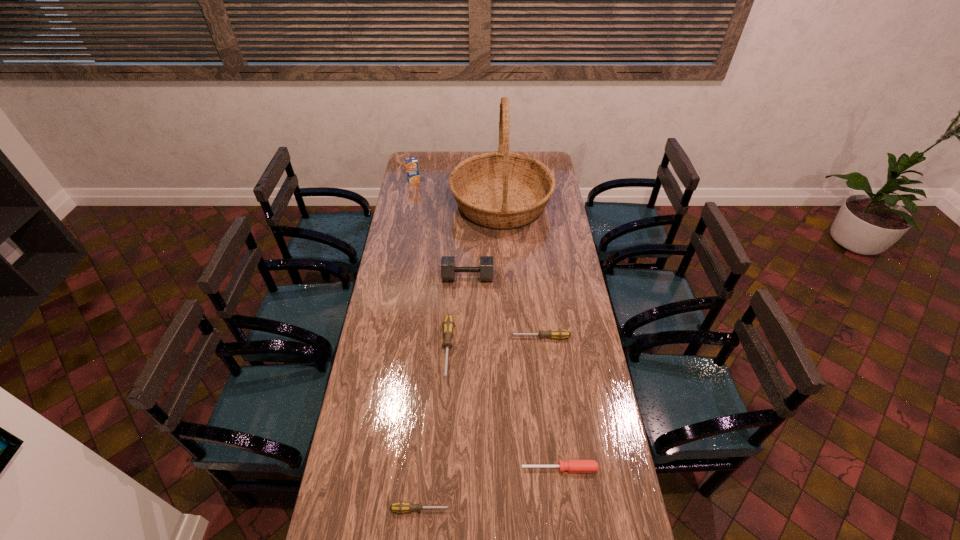
Identify the location of vacant space situated 0.050m on the back of the red screwdriver. This screenshot has height=540, width=960. (557, 448).

Identify the location of free space located 0.370m at the tip of the nearest gray screwdriver. Image resolution: width=960 pixels, height=540 pixels. (575, 509).

This screenshot has height=540, width=960. I want to click on object that is at the left edge, so click(x=412, y=169).

Where is `basket at the right edge`? basket at the right edge is located at coordinates (501, 189).

The height and width of the screenshot is (540, 960). Identify the location of blank space at the far edge of the desktop. (461, 160).

I want to click on vacant space at the left edge of the desktop, so click(x=393, y=322).

You are a GUI agent. You are given a task and a screenshot of the screen. Output one action in this format:
    pyautogui.click(x=<x>, y=<y>)
    Task: Click on the vacant space at the right edge of the desktop
    
    Given the screenshot: What is the action you would take?
    pyautogui.click(x=590, y=349)

The width and height of the screenshot is (960, 540). I want to click on unoccupied position between the red screwdriver and the basket, so click(x=531, y=336).

Where is `vacant area that lies between the basket and the third farthest object`? Image resolution: width=960 pixels, height=540 pixels. vacant area that lies between the basket and the third farthest object is located at coordinates (485, 241).

What are the coordinates of `empty location between the fifth tallest object and the sixth shortest object` in the screenshot? It's located at (477, 259).